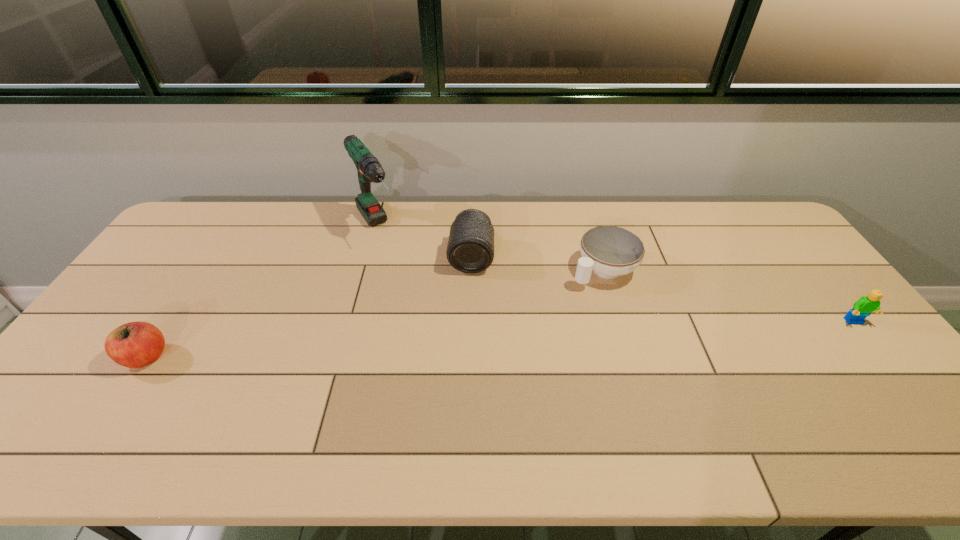
What are the coordinates of `apple` in the screenshot? It's located at (137, 344).

The image size is (960, 540). What are the coordinates of `the leftmost object` in the screenshot? It's located at (137, 344).

The height and width of the screenshot is (540, 960). Find the location of `the rightmost object`. the rightmost object is located at coordinates (865, 305).

Locate an element on the screen. the fourth farthest object is located at coordinates (865, 305).

Identify the location of chinaware. The width and height of the screenshot is (960, 540). (611, 251).

You are a GUI agent. You are given a task and a screenshot of the screen. Output one action in this format:
    pyautogui.click(x=<x>, y=<y>)
    Task: Click on the telephoto lens
    
    Given the screenshot: What is the action you would take?
    pyautogui.click(x=470, y=249)

In order to click on the second tallest object in this screenshot , I will do `click(470, 249)`.

The image size is (960, 540). Find the location of `the tallest object`. the tallest object is located at coordinates (369, 169).

Where is `drill`? drill is located at coordinates (369, 169).

Image resolution: width=960 pixels, height=540 pixels. Find the location of `free space located 0.390m on the back of the apple`. free space located 0.390m on the back of the apple is located at coordinates (219, 247).